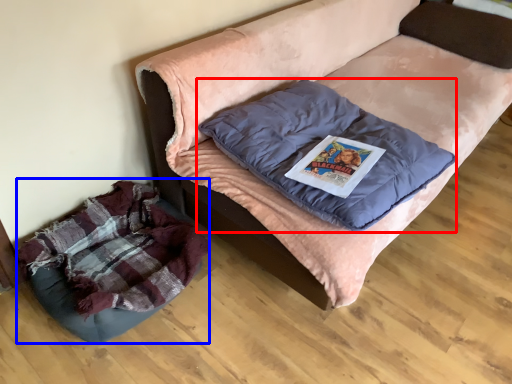
Question: Among these objects, which one is nearest to the camera, pillow (highlighted by a red box) or dog bed (highlighted by a blue box)?

Choices:
 (A) pillow
 (B) dog bed

Answer: (A)